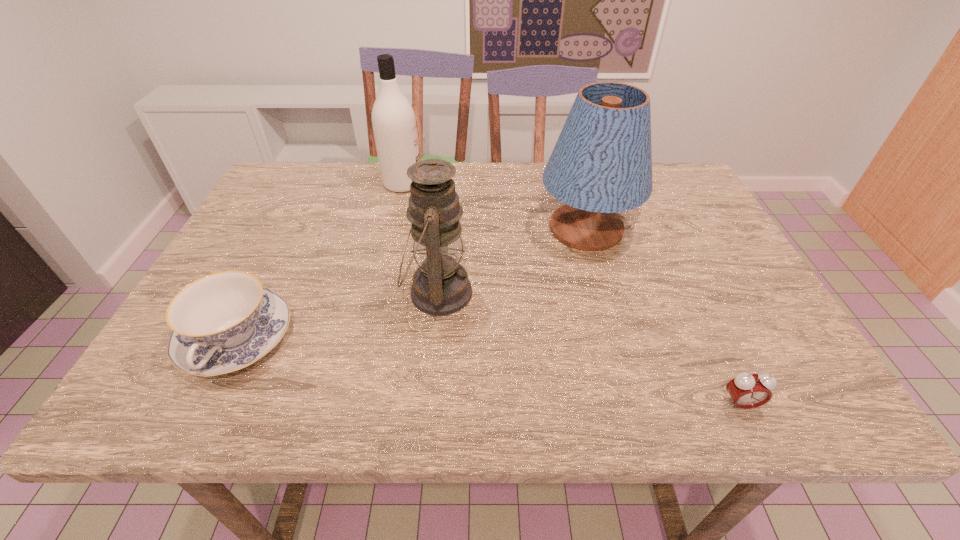
This screenshot has width=960, height=540. What are the coordinates of `lampshade that is at the far edge` in the screenshot? It's located at (602, 162).

Locate an element on the screen. This screenshot has width=960, height=540. chinaware that is at the near edge is located at coordinates (223, 322).

Where is `alarm clock that is at the near edge`? This screenshot has height=540, width=960. alarm clock that is at the near edge is located at coordinates (747, 391).

The image size is (960, 540). Find the location of `object present at the left edge`. object present at the left edge is located at coordinates (223, 322).

In order to click on object present at the right edge in this screenshot , I will do `click(747, 391)`.

Identify the location of object located in the near left corner section of the desktop. Image resolution: width=960 pixels, height=540 pixels. (223, 322).

This screenshot has width=960, height=540. I want to click on object positioned at the near right corner, so click(x=747, y=391).

In the image, there is a desktop. At what (x,y) coordinates should I click in order to perform the action: click on free space at the far edge. Please return your answer as a coordinate pair (x, y). The image size is (960, 540). Looking at the image, I should click on (541, 173).

In the image, there is a desktop. At what (x,y) coordinates should I click in order to perform the action: click on vacant space at the near edge. Please return your answer as a coordinate pair (x, y). Looking at the image, I should click on (353, 410).

At what (x,y) coordinates should I click in order to perform the action: click on vacant area at the left edge of the desktop. Please return your answer as a coordinate pair (x, y). This screenshot has height=540, width=960. Looking at the image, I should click on (253, 245).